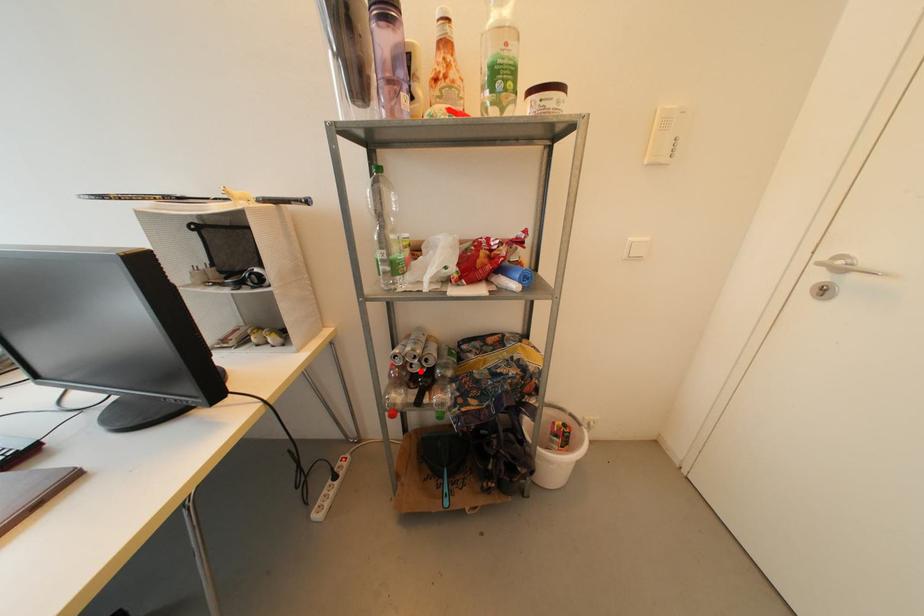
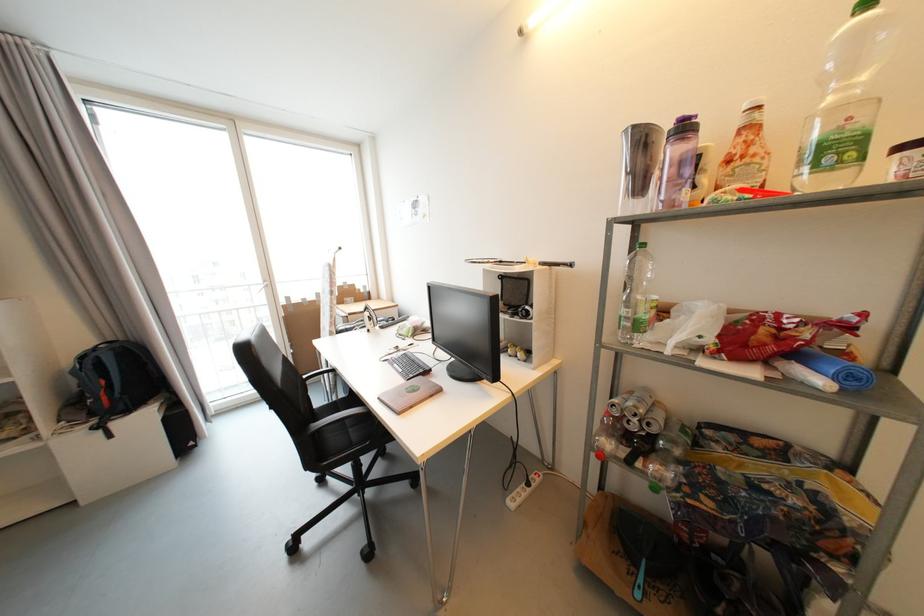
In the second image, find the point that corresponds to the highlighted location in the first image.

(638, 430)